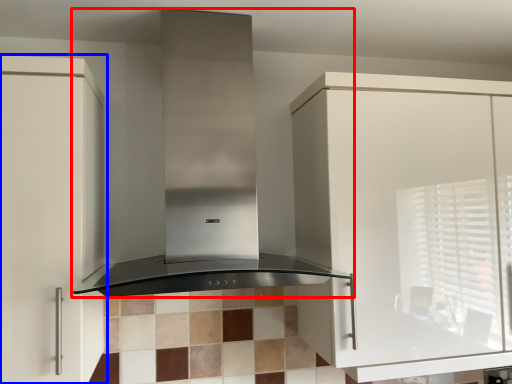
Question: Which object is further to the camera taking this photo, home appliance (highlighted by a red box) or cabinetry (highlighted by a blue box)?

Choices:
 (A) home appliance
 (B) cabinetry

Answer: (B)